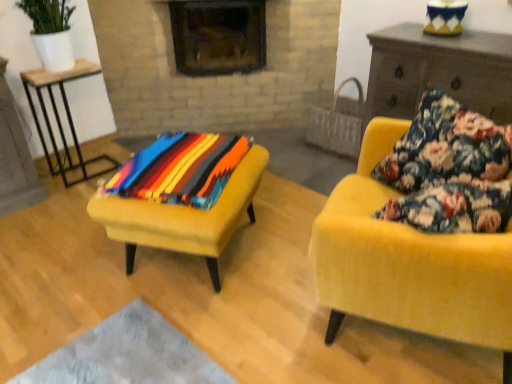
Question: Can you confirm if floral fabric pillow at right is bigger than wooden table at left?

Choices:
 (A) no
 (B) yes

Answer: (A)

Question: Is floral fabric pillow at right turned away from wooden table at left?

Choices:
 (A) yes
 (B) no

Answer: (B)

Question: Considering the relative sizes of floral fabric pillow at right and wooden table at left in the image provided, is floral fabric pillow at right thinner than wooden table at left?

Choices:
 (A) yes
 (B) no

Answer: (A)

Question: Is floral fabric pillow at right not close to wooden table at left?

Choices:
 (A) yes
 (B) no

Answer: (A)

Question: Would you say floral fabric pillow at right contains wooden table at left?

Choices:
 (A) no
 (B) yes

Answer: (A)

Question: From a real-world perspective, is floral fabric pillow at right located beneath wooden table at left?

Choices:
 (A) no
 (B) yes

Answer: (A)

Question: From a real-world perspective, is velvet yellow stool at center located beneath velvet yellow armchair at right?

Choices:
 (A) yes
 (B) no

Answer: (A)

Question: Is velvet yellow stool at center shorter than velvet yellow armchair at right?

Choices:
 (A) no
 (B) yes

Answer: (B)

Question: Does velvet yellow stool at center turn towards velvet yellow armchair at right?

Choices:
 (A) no
 (B) yes

Answer: (A)

Question: Is velvet yellow stool at center at the left side of velvet yellow armchair at right?

Choices:
 (A) no
 (B) yes

Answer: (B)

Question: Is velvet yellow stool at center positioned beyond the bounds of velvet yellow armchair at right?

Choices:
 (A) no
 (B) yes

Answer: (B)

Question: Is velvet yellow armchair at right completely or partially inside velvet yellow stool at center?

Choices:
 (A) no
 (B) yes

Answer: (A)

Question: Considering the relative sizes of wooden table at left and wooden dresser at right in the image provided, is wooden table at left taller than wooden dresser at right?

Choices:
 (A) no
 (B) yes

Answer: (A)